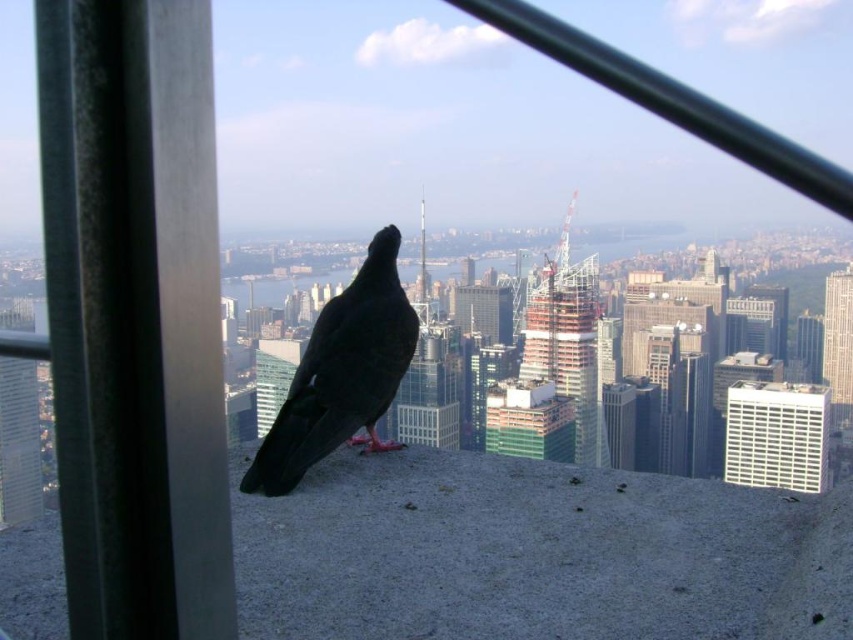
Question: Can you confirm if black matte bird at center is wider than white textured window at center right?

Choices:
 (A) yes
 (B) no

Answer: (A)

Question: Considering the relative positions of black matte bird at center and white textured window at center right in the image provided, where is black matte bird at center located with respect to white textured window at center right?

Choices:
 (A) right
 (B) left

Answer: (B)

Question: Among these objects, which one is nearest to the camera?

Choices:
 (A) black matte bird at center
 (B) white textured window at center right

Answer: (A)

Question: Which point appears farthest from the camera in this image?

Choices:
 (A) (328, 428)
 (B) (759, 436)

Answer: (B)

Question: Is black matte bird at center bigger than white textured window at center right?

Choices:
 (A) no
 (B) yes

Answer: (B)

Question: Which point is farther to the camera?

Choices:
 (A) (363, 417)
 (B) (825, 460)

Answer: (B)